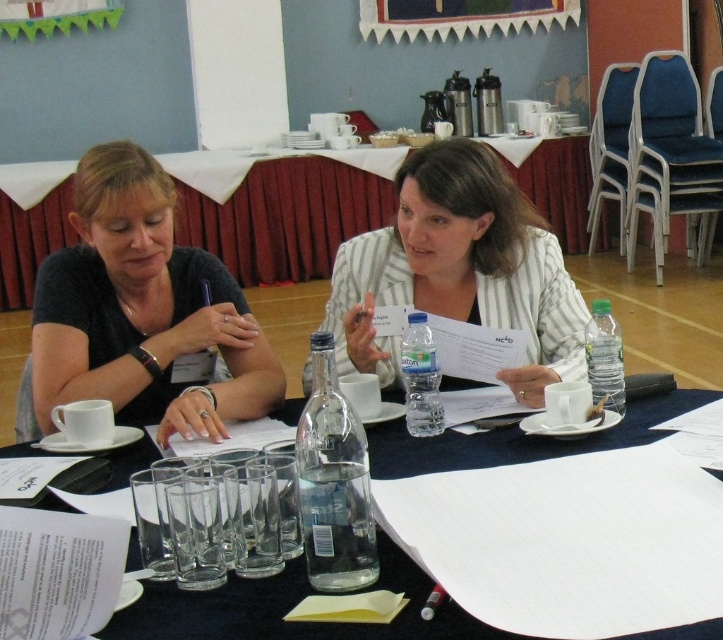
Question: Can you confirm if white striped blazer at center is positioned to the left of clear plastic glasses at lower left?

Choices:
 (A) no
 (B) yes

Answer: (A)

Question: Does white striped blazer at center have a greater width compared to white paper at center?

Choices:
 (A) no
 (B) yes

Answer: (A)

Question: Which point is closer to the camera?

Choices:
 (A) (294, 266)
 (B) (440, 177)
 (C) (474, 449)
 (D) (194, 339)

Answer: (C)

Question: Which of these objects is positioned farthest from the white paper at center?

Choices:
 (A) white striped blazer at center
 (B) wooden bulletin board at upper center
 (C) clear plastic glasses at lower left
 (D) matte black shirt at left

Answer: (C)

Question: Which object is positioned farthest from the wooden bulletin board at upper center?

Choices:
 (A) matte black shirt at left
 (B) clear plastic glasses at lower left

Answer: (B)

Question: Does white paper at center appear on the right side of wooden bulletin board at upper center?

Choices:
 (A) yes
 (B) no

Answer: (B)